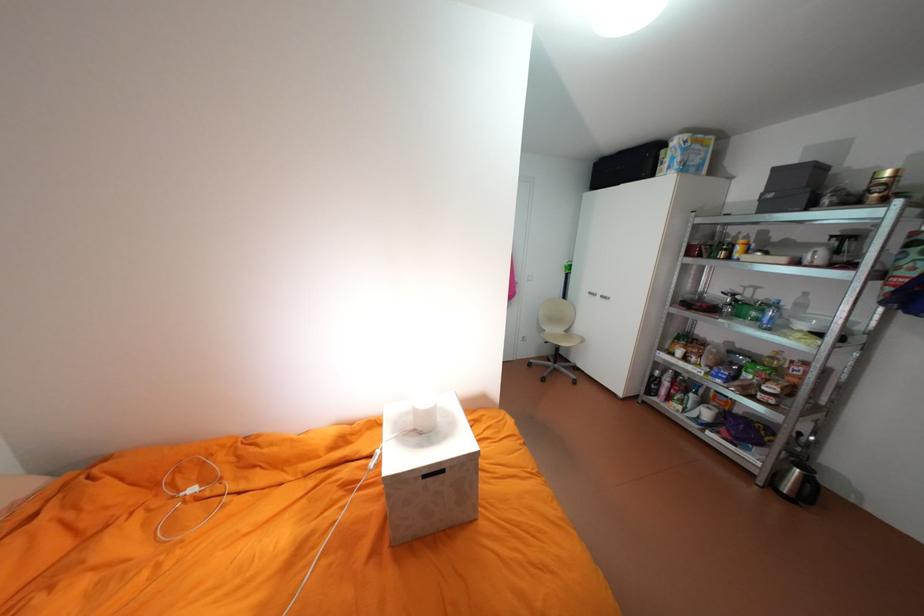
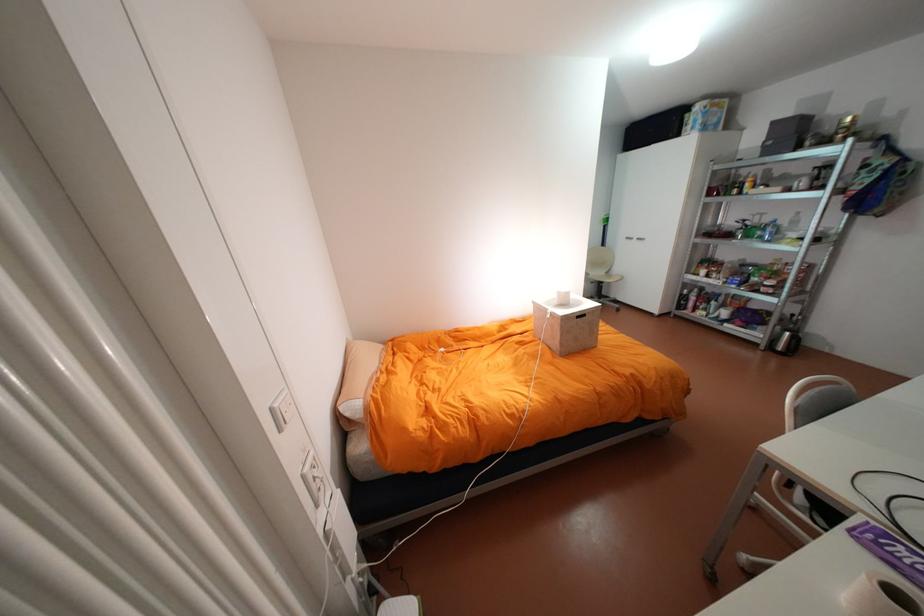
The point at (772, 294) is marked in the first image. Where is the corresponding point in the second image?

(775, 219)